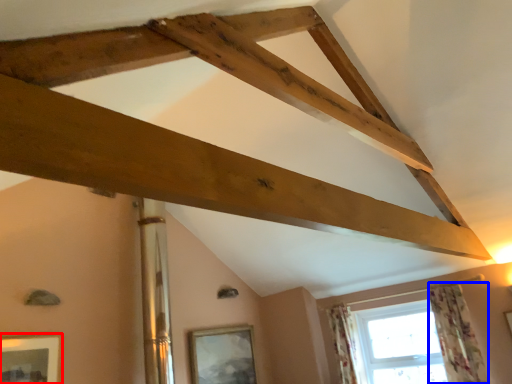
Question: Which of the following is the closest to the observer, picture frame (highlighted by a red box) or curtain (highlighted by a blue box)?

Choices:
 (A) picture frame
 (B) curtain

Answer: (A)